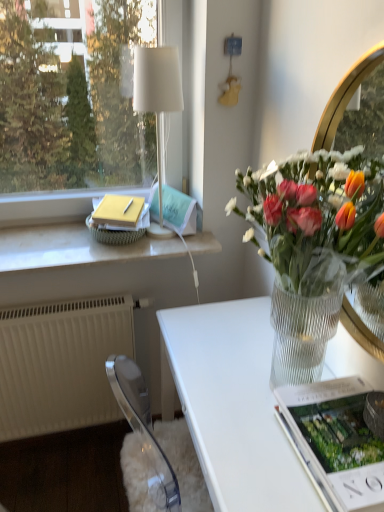
Where is `free point below clear glass vase at right (from a real-world perspective)`? The image size is (384, 512). free point below clear glass vase at right (from a real-world perspective) is located at coordinates (259, 376).